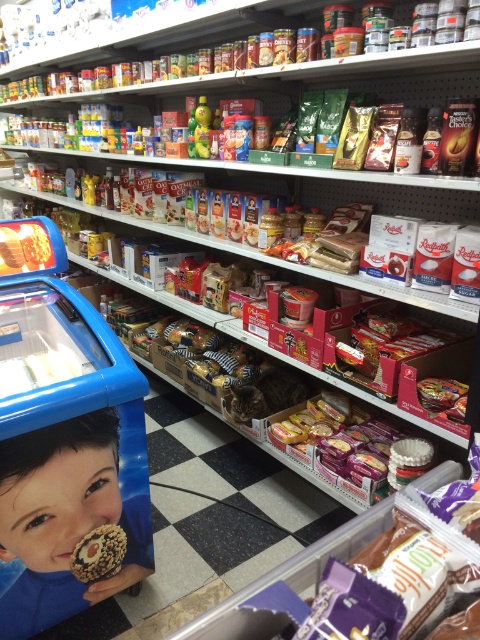
Is smooth skin child at lower left above chocolate-coated nuts at lower left?

Correct, smooth skin child at lower left is located above chocolate-coated nuts at lower left.

Is smooth skin child at lower left closer to the viewer compared to chocolate-coated nuts at lower left?

Yes, smooth skin child at lower left is in front of chocolate-coated nuts at lower left.

I want to click on smooth skin child at lower left, so click(x=57, y=516).